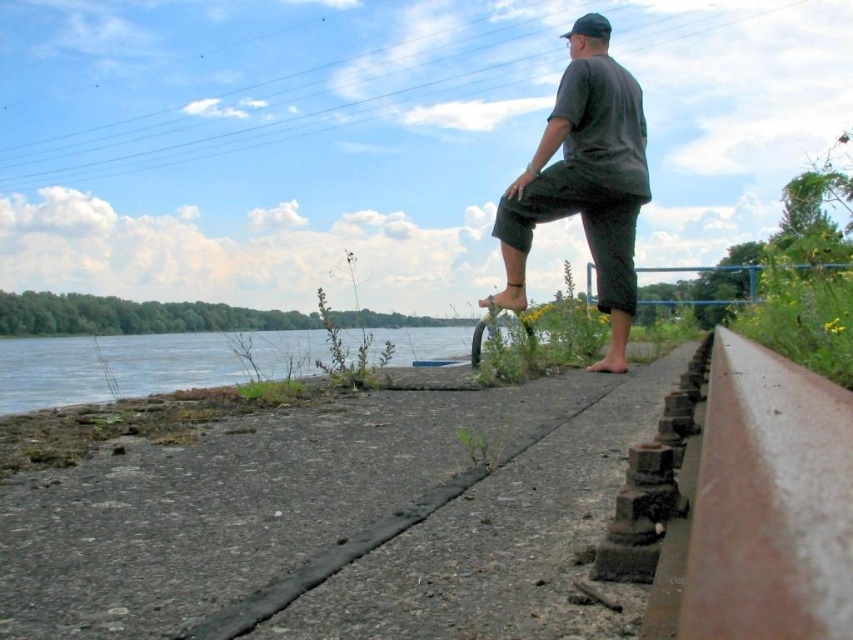
Question: Which object appears farthest from the camera in this image?

Choices:
 (A) dark gray fabric pants at center
 (B) gray concrete pavement at center

Answer: (A)

Question: Does gray concrete pavement at center have a greater width compared to dark gray fabric pants at center?

Choices:
 (A) yes
 (B) no

Answer: (A)

Question: Among these objects, which one is farthest from the camera?

Choices:
 (A) gray concrete pavement at center
 (B) dark gray fabric pants at center

Answer: (B)

Question: Is gray concrete pavement at center positioned behind dark gray fabric pants at center?

Choices:
 (A) yes
 (B) no

Answer: (B)

Question: Can you confirm if gray concrete pavement at center is positioned below dark gray fabric pants at center?

Choices:
 (A) yes
 (B) no

Answer: (A)

Question: Which point is closer to the camera?

Choices:
 (A) (613, 168)
 (B) (42, 502)

Answer: (B)